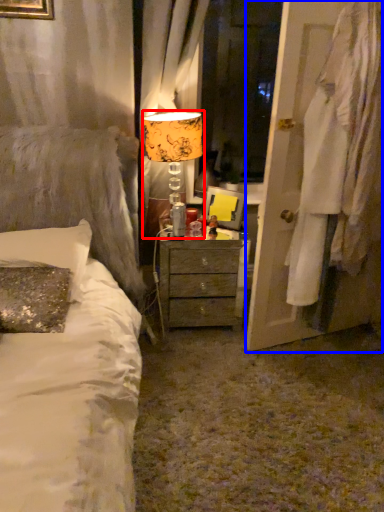
Question: Which object appears farthest to the camera in this image, table lamp (highlighted by a red box) or door (highlighted by a blue box)?

Choices:
 (A) table lamp
 (B) door

Answer: (A)